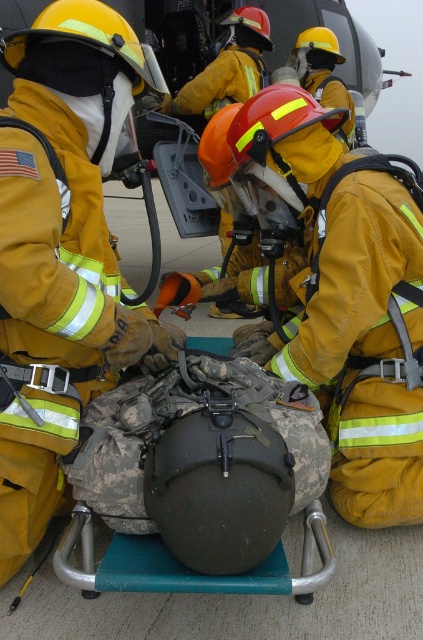
How far apart are yellow reflective uniform at center and orange reflective helmet at center?

yellow reflective uniform at center and orange reflective helmet at center are 7.21 feet apart.

Based on the photo, which is above, yellow reflective uniform at center or orange reflective helmet at center?

orange reflective helmet at center is higher up.

Is point (76, 435) closer to camera compared to point (238, 68)?

Yes, point (76, 435) is in front of point (238, 68).

Identify the location of yellow reflective uniform at center. (60, 250).

Is orange reflective helmet at center thinner than yellow reflective helmet at center?

In fact, orange reflective helmet at center might be wider than yellow reflective helmet at center.

Which of these two, orange reflective helmet at center or yellow reflective helmet at center, stands shorter?

With less height is orange reflective helmet at center.

Does point (244, 72) come behind point (293, 51)?

No, (244, 72) is closer to viewer.

You are a GUI agent. You are given a task and a screenshot of the screen. Output one action in this format:
    pyautogui.click(x=<x>, y=<y>)
    Task: Click on the orange reflective helmet at center
    Image resolution: width=423 pixels, height=640 pixels.
    Given the screenshot: What is the action you would take?
    pyautogui.click(x=228, y=67)

Is camouflage helmet at center taller than orange reflective helmet at center?

Yes, camouflage helmet at center is taller than orange reflective helmet at center.

Does camouflage helmet at center have a larger size compared to orange reflective helmet at center?

Indeed, camouflage helmet at center has a larger size compared to orange reflective helmet at center.

Who is more distant from viewer, (x=346, y=426) or (x=239, y=20)?

Point (x=239, y=20)

Image resolution: width=423 pixels, height=640 pixels. Find the location of `camouflage helmet at center`. camouflage helmet at center is located at coordinates [x=343, y=292].